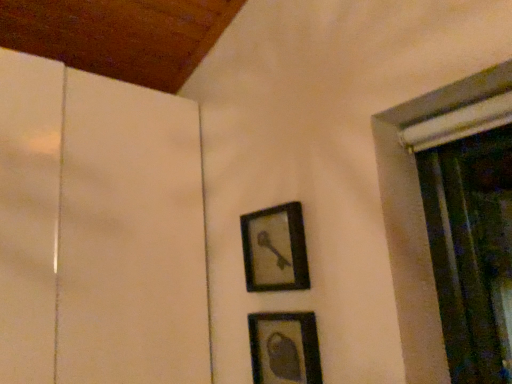
Where is `matte black picture frame at center, placed as the second picture frame when sorted from bottom to top`? The image size is (512, 384). matte black picture frame at center, placed as the second picture frame when sorted from bottom to top is located at coordinates (275, 249).

The image size is (512, 384). What do you see at coordinates (275, 249) in the screenshot?
I see `matte black picture frame at center, placed as the first picture frame when sorted from top to bottom` at bounding box center [275, 249].

At what (x,y) coordinates should I click in order to perform the action: click on matte black picture frame at lower center, the second picture frame positioned from the top. Please return your answer as a coordinate pair (x, y). The width and height of the screenshot is (512, 384). Looking at the image, I should click on (284, 348).

Describe the element at coordinates (284, 348) in the screenshot. I see `matte black picture frame at lower center, the second picture frame positioned from the top` at that location.

Locate an element on the screen. Image resolution: width=512 pixels, height=384 pixels. matte black picture frame at center, placed as the second picture frame when sorted from bottom to top is located at coordinates (275, 249).

Considering the relative positions of matte black picture frame at center, placed as the first picture frame when sorted from top to bottom, and matte black picture frame at lower center, acting as the first picture frame starting from the bottom, in the image provided, is matte black picture frame at center, placed as the first picture frame when sorted from top to bottom, to the left of matte black picture frame at lower center, acting as the first picture frame starting from the bottom, from the viewer's perspective?

Indeed, matte black picture frame at center, placed as the first picture frame when sorted from top to bottom, is positioned on the left side of matte black picture frame at lower center, acting as the first picture frame starting from the bottom.

Does matte black picture frame at center, placed as the second picture frame when sorted from bottom to top, lie behind matte black picture frame at lower center, the second picture frame positioned from the top?

Yes, matte black picture frame at center, placed as the second picture frame when sorted from bottom to top, is behind matte black picture frame at lower center, the second picture frame positioned from the top.

Is point (269, 276) farther from camera compared to point (306, 382)?

That is True.

From the image's perspective, does matte black picture frame at center, placed as the second picture frame when sorted from bottom to top, appear lower than matte black picture frame at lower center, acting as the first picture frame starting from the bottom?

Actually, matte black picture frame at center, placed as the second picture frame when sorted from bottom to top, appears above matte black picture frame at lower center, acting as the first picture frame starting from the bottom, in the image.

From a real-world perspective, is matte black picture frame at center, placed as the second picture frame when sorted from bottom to top, under matte black picture frame at lower center, the second picture frame positioned from the top?

No, from a real-world perspective, matte black picture frame at center, placed as the second picture frame when sorted from bottom to top, is not below matte black picture frame at lower center, the second picture frame positioned from the top.

Is matte black picture frame at center, placed as the first picture frame when sorted from top to bottom, wider or thinner than matte black picture frame at lower center, the second picture frame positioned from the top?

In the image, matte black picture frame at center, placed as the first picture frame when sorted from top to bottom, appears to be wider than matte black picture frame at lower center, the second picture frame positioned from the top.

Is matte black picture frame at center, placed as the second picture frame when sorted from bottom to top, taller or shorter than matte black picture frame at lower center, the second picture frame positioned from the top?

In the image, matte black picture frame at center, placed as the second picture frame when sorted from bottom to top, appears to be taller than matte black picture frame at lower center, the second picture frame positioned from the top.

Is matte black picture frame at center, placed as the first picture frame when sorted from top to bottom, smaller than matte black picture frame at lower center, acting as the first picture frame starting from the bottom?

Actually, matte black picture frame at center, placed as the first picture frame when sorted from top to bottom, might be larger than matte black picture frame at lower center, acting as the first picture frame starting from the bottom.

Consider the image. Is matte black picture frame at lower center, the second picture frame positioned from the top, completely or partially inside matte black picture frame at center, placed as the second picture frame when sorted from bottom to top?

No.

Is matte black picture frame at center, placed as the first picture frame when sorted from top to bottom, touching matte black picture frame at lower center, the second picture frame positioned from the top?

matte black picture frame at center, placed as the first picture frame when sorted from top to bottom, and matte black picture frame at lower center, the second picture frame positioned from the top, are clearly separated.

Is matte black picture frame at center, placed as the second picture frame when sorted from bottom to top, oriented towards matte black picture frame at lower center, the second picture frame positioned from the top?

No.

What's the angular difference between matte black picture frame at center, placed as the second picture frame when sorted from bottom to top, and matte black picture frame at lower center, acting as the first picture frame starting from the bottom,'s facing directions?

The angle between the facing direction of matte black picture frame at center, placed as the second picture frame when sorted from bottom to top, and the facing direction of matte black picture frame at lower center, acting as the first picture frame starting from the bottom, is 0.0039 degrees.

From the picture: Could you measure the distance between matte black picture frame at center, placed as the first picture frame when sorted from top to bottom, and matte black picture frame at lower center, acting as the first picture frame starting from the bottom?

They are 6.91 inches apart.

The width and height of the screenshot is (512, 384). I want to click on picture frame below the matte black picture frame at center, placed as the second picture frame when sorted from bottom to top (from the image's perspective), so click(284, 348).

Based on their positions, is matte black picture frame at lower center, the second picture frame positioned from the top, located to the left or right of matte black picture frame at center, placed as the second picture frame when sorted from bottom to top?

In the image, matte black picture frame at lower center, the second picture frame positioned from the top, appears on the right side of matte black picture frame at center, placed as the second picture frame when sorted from bottom to top.

Which object is closer to the camera taking this photo, matte black picture frame at lower center, acting as the first picture frame starting from the bottom, or matte black picture frame at center, placed as the first picture frame when sorted from top to bottom?

Positioned in front is matte black picture frame at lower center, acting as the first picture frame starting from the bottom.

Considering the positions of points (290, 378) and (285, 217), is point (290, 378) closer to camera compared to point (285, 217)?

Yes, point (290, 378) is in front of point (285, 217).

From the image's perspective, which is below, matte black picture frame at lower center, acting as the first picture frame starting from the bottom, or matte black picture frame at center, placed as the second picture frame when sorted from bottom to top?

matte black picture frame at lower center, acting as the first picture frame starting from the bottom, appears lower in the image.

From a real-world perspective, which is physically above, matte black picture frame at lower center, the second picture frame positioned from the top, or matte black picture frame at center, placed as the second picture frame when sorted from bottom to top?

matte black picture frame at center, placed as the second picture frame when sorted from bottom to top, is physically above.

Which object is thinner, matte black picture frame at lower center, the second picture frame positioned from the top, or matte black picture frame at center, placed as the first picture frame when sorted from top to bottom?

matte black picture frame at lower center, the second picture frame positioned from the top, is thinner.

Is matte black picture frame at lower center, the second picture frame positioned from the top, taller or shorter than matte black picture frame at center, placed as the second picture frame when sorted from bottom to top?

matte black picture frame at lower center, the second picture frame positioned from the top, is shorter than matte black picture frame at center, placed as the second picture frame when sorted from bottom to top.

Is matte black picture frame at lower center, the second picture frame positioned from the top, smaller than matte black picture frame at center, placed as the first picture frame when sorted from top to bottom?

Yes.

Choose the correct answer: Is matte black picture frame at lower center, acting as the first picture frame starting from the bottom, inside matte black picture frame at center, placed as the first picture frame when sorted from top to bottom, or outside it?

matte black picture frame at lower center, acting as the first picture frame starting from the bottom, is located beyond the bounds of matte black picture frame at center, placed as the first picture frame when sorted from top to bottom.

Are matte black picture frame at lower center, the second picture frame positioned from the top, and matte black picture frame at center, placed as the first picture frame when sorted from top to bottom, located far from each other?

matte black picture frame at lower center, the second picture frame positioned from the top, is near matte black picture frame at center, placed as the first picture frame when sorted from top to bottom, not far away.

Is matte black picture frame at lower center, the second picture frame positioned from the top, facing towards matte black picture frame at center, placed as the first picture frame when sorted from top to bottom?

No, matte black picture frame at lower center, the second picture frame positioned from the top, does not turn towards matte black picture frame at center, placed as the first picture frame when sorted from top to bottom.

How many degrees apart are the facing directions of matte black picture frame at lower center, acting as the first picture frame starting from the bottom, and matte black picture frame at center, placed as the second picture frame when sorted from bottom to top?

matte black picture frame at lower center, acting as the first picture frame starting from the bottom, and matte black picture frame at center, placed as the second picture frame when sorted from bottom to top, are facing 0.0039 degrees away from each other.

Image resolution: width=512 pixels, height=384 pixels. In order to click on picture frame behind the matte black picture frame at lower center, the second picture frame positioned from the top in this screenshot , I will do `click(275, 249)`.

Find the location of `picture frame below the matte black picture frame at center, placed as the first picture frame when sorted from top to bottom (from the image's perspective)`. picture frame below the matte black picture frame at center, placed as the first picture frame when sorted from top to bottom (from the image's perspective) is located at coordinates (284, 348).

Where is `picture frame above the matte black picture frame at lower center, the second picture frame positioned from the top (from a real-world perspective)`? picture frame above the matte black picture frame at lower center, the second picture frame positioned from the top (from a real-world perspective) is located at coordinates (275, 249).